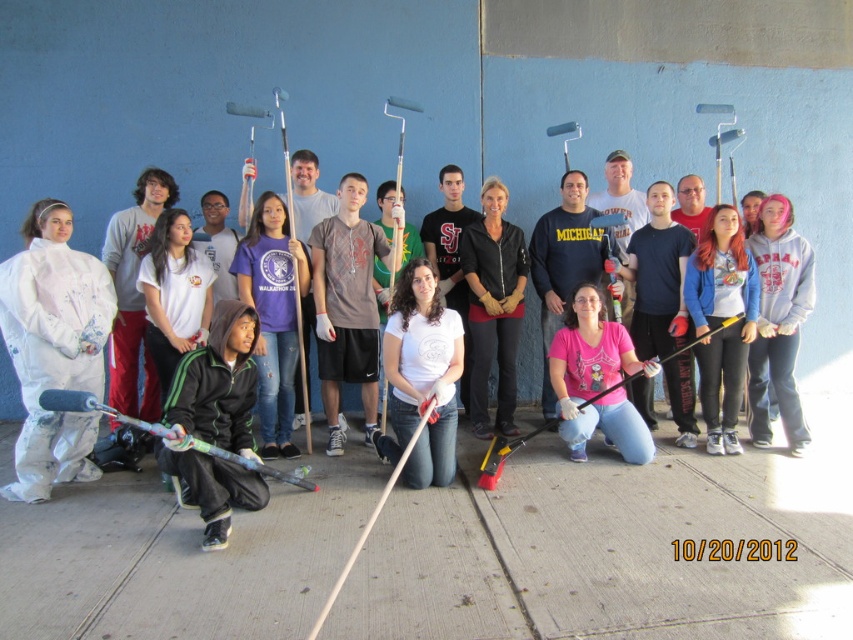
Question: Considering the real-world distances, which object is closest to the black leather jacket at center?

Choices:
 (A) gray fleece sweatshirt at center
 (B) green hoodie at center

Answer: (A)

Question: From the image, what is the correct spatial relationship of white matte coveralls at left in relation to green hoodie at center?

Choices:
 (A) above
 (B) below

Answer: (A)

Question: Does white matte coveralls at left appear on the right side of gray fleece sweatshirt at center?

Choices:
 (A) yes
 (B) no

Answer: (B)

Question: Among these objects, which one is farthest from the camera?

Choices:
 (A) green hoodie at center
 (B) black leather jacket at center

Answer: (B)

Question: Among these points, which one is farthest from the camera?

Choices:
 (A) (24, 324)
 (B) (492, 256)

Answer: (B)

Question: Is white matte coveralls at left wider than gray fleece sweatshirt at center?

Choices:
 (A) no
 (B) yes

Answer: (B)